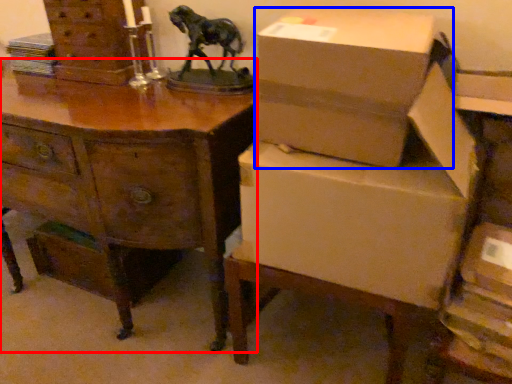
Question: Which object is further to the camera taking this photo, desk (highlighted by a red box) or box (highlighted by a blue box)?

Choices:
 (A) desk
 (B) box

Answer: (A)